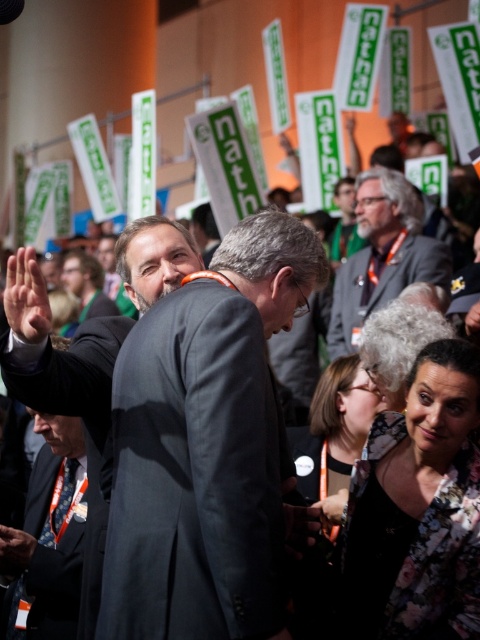
You are a photographer at the event and need to capture a photo of both the dark gray suit at center and the dark gray suit at lower left in the same frame. Given that your camera has a maximum focus range of 3 meters, will you be able to include both individuals in a single focused shot?

The dark gray suit at center and dark gray suit at lower left are 3.32 meters apart from each other. Since the distance between them exceeds the camera focus range of 3 meters, you cannot include both individuals in a single focused shot.

You are standing at the entrance of the hall and want to approach the dark gray suit at center. Which direction should you move to reach them?

The dark gray suit at center is located at point coordinates, so you should move towards the center of the hall to reach them.